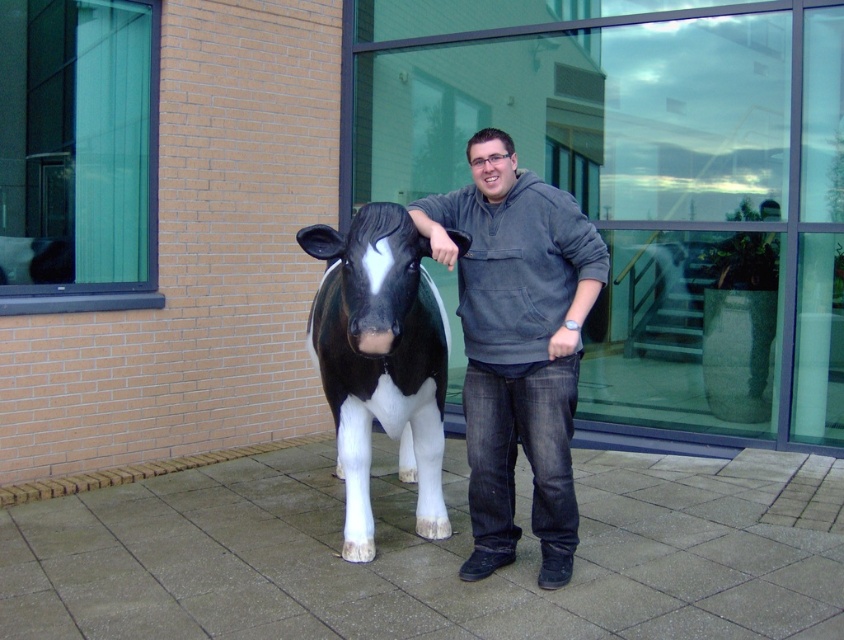
Does gray hoodie at center appear under black glossy plastic bull at center?

Yes.

Which is in front, point (501, 486) or point (399, 404)?

Point (501, 486) is more forward.

Is point (553, 308) positioned behind point (414, 451)?

No, it is in front of (414, 451).

Find the location of a particular element. gray hoodie at center is located at coordinates (517, 344).